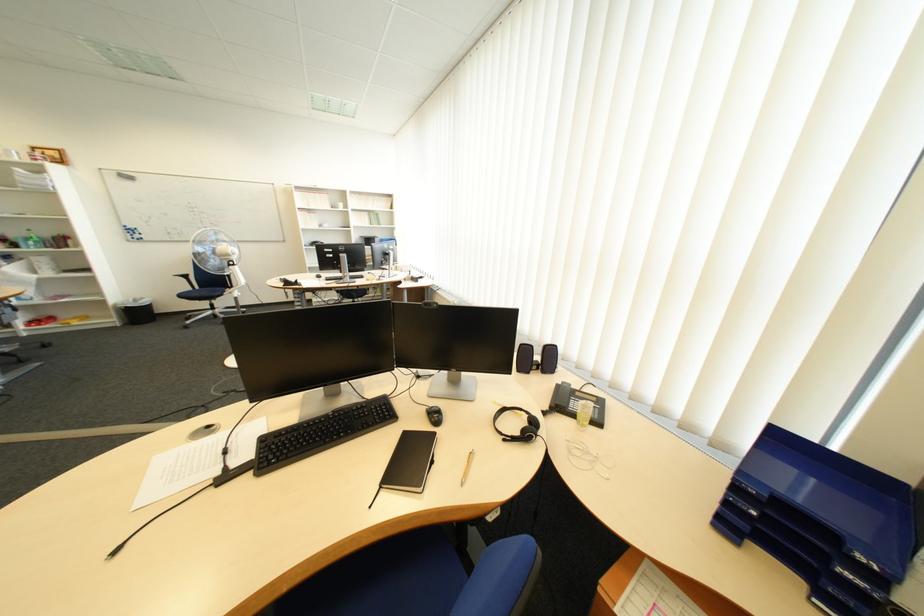
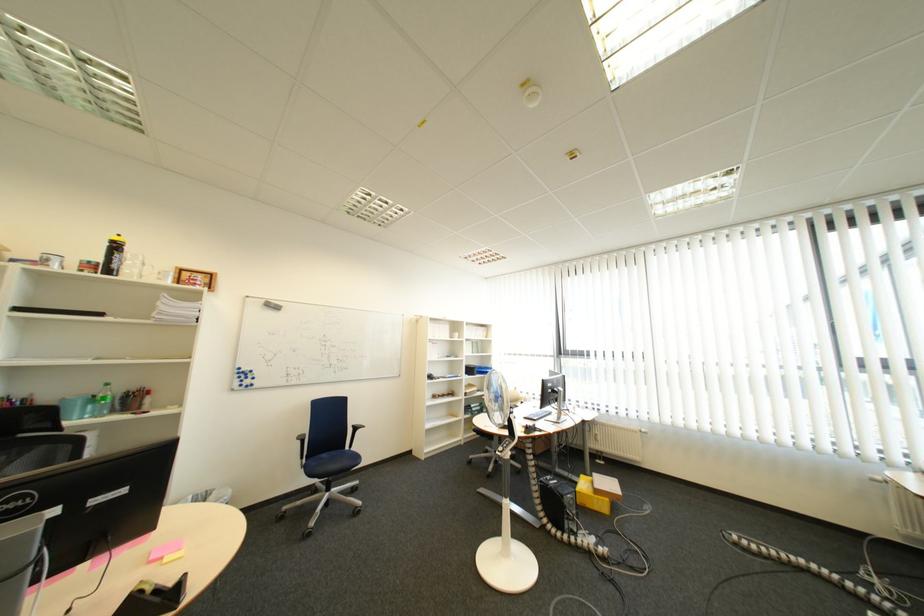
Find the pixel in the second image that matches (41,240) in the first image.

(105, 400)